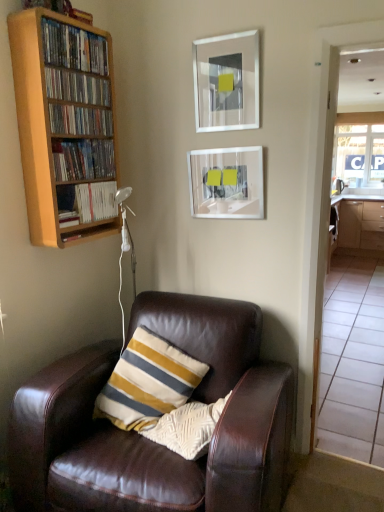
This screenshot has width=384, height=512. What do you see at coordinates (356, 165) in the screenshot?
I see `transparent glass door at right` at bounding box center [356, 165].

Looking at this image, what is the approximate height of brown leather chair at lower left?

34.05 inches.

What do you see at coordinates (77, 87) in the screenshot? I see `wooden shelf at upper left, which is the 2th book from top to bottom` at bounding box center [77, 87].

Find the location of `wooden bookshelf at upper left, the 2th book when ordered from bottom to top`. wooden bookshelf at upper left, the 2th book when ordered from bottom to top is located at coordinates (83, 159).

In order to face white glossy cabinetry at right, should I rotate leftwards or rightwards?

To align with it, rotate right about 21.681°.

In order to face wooden bookshelf at upper left, acting as the 3th book starting from the bottom, should I rotate leftwards or rightwards?

To face it directly, rotate left by 15.119 degrees.

Identify the location of transparent glass door at right. The image size is (384, 512). (356, 165).

Is white glossy cabinetry at right further to the viewer compared to silver metallic picture frame at upper center, the second picture frame ordered from the bottom?

Yes, white glossy cabinetry at right is further from the viewer.

Based on the photo, can you tell me how much white glossy cabinetry at right and silver metallic picture frame at upper center, the 1th picture frame when ordered from top to bottom, differ in facing direction?

They differ by 0.432 degrees in their facing directions.

From a real-world perspective, is white glossy cabinetry at right physically below silver metallic picture frame at upper center, the second picture frame ordered from the bottom?

Yes, from a real-world perspective, white glossy cabinetry at right is under silver metallic picture frame at upper center, the second picture frame ordered from the bottom.

Can you confirm if white glossy cabinetry at right is bigger than silver metallic picture frame at upper center, the second picture frame ordered from the bottom?

Yes.

Which object is more forward, wooden shelf at upper left, which is the 2th book from top to bottom, or wooden bookshelf at upper left, acting as the 3th book starting from the bottom?

wooden shelf at upper left, which is the 2th book from top to bottom, is closer to the camera.

From a real-world perspective, is wooden shelf at upper left, positioned as the fourth book in bottom-to-top order, above or below wooden bookshelf at upper left, the 3th book positioned from the top?

From a real-world perspective, wooden shelf at upper left, positioned as the fourth book in bottom-to-top order, is physically above wooden bookshelf at upper left, the 3th book positioned from the top.

Is wooden shelf at upper left, positioned as the fourth book in bottom-to-top order, facing towards wooden bookshelf at upper left, acting as the 3th book starting from the bottom?

No, wooden shelf at upper left, positioned as the fourth book in bottom-to-top order, is not turned towards wooden bookshelf at upper left, acting as the 3th book starting from the bottom.

Considering the sizes of objects wooden shelf at upper left, which is the 2th book from top to bottom, and wooden bookshelf at upper left, the 3th book positioned from the top, in the image provided, who is smaller, wooden shelf at upper left, which is the 2th book from top to bottom, or wooden bookshelf at upper left, the 3th book positioned from the top,?

wooden bookshelf at upper left, the 3th book positioned from the top, is smaller.

Does wooden bookcase at left have a larger size compared to wooden shelf at upper left, which is the 2th book from top to bottom?

Yes, wooden bookcase at left is bigger than wooden shelf at upper left, which is the 2th book from top to bottom.

Considering the sizes of wooden bookcase at left and wooden shelf at upper left, positioned as the fourth book in bottom-to-top order, in the image, is wooden bookcase at left wider or thinner than wooden shelf at upper left, positioned as the fourth book in bottom-to-top order,?

Considering their sizes, wooden bookcase at left looks broader than wooden shelf at upper left, positioned as the fourth book in bottom-to-top order.

Does wooden bookcase at left appear on the left side of wooden shelf at upper left, which is the 2th book from top to bottom?

Yes, wooden bookcase at left is to the left of wooden shelf at upper left, which is the 2th book from top to bottom.

Considering the points (47, 23) and (96, 94), which point is in front, point (47, 23) or point (96, 94)?

The point (47, 23) is closer to the camera.

How distant is wooden shelf at upper left, arranged as the first book when viewed from the top, from wooden bookcase at left?

wooden shelf at upper left, arranged as the first book when viewed from the top, and wooden bookcase at left are 8.12 inches apart.

Considering the relative sizes of wooden shelf at upper left, arranged as the first book when viewed from the top, and wooden bookcase at left in the image provided, is wooden shelf at upper left, arranged as the first book when viewed from the top, bigger than wooden bookcase at left?

No.

Would you say wooden shelf at upper left, placed as the 5th book when sorted from bottom to top, is inside or outside wooden bookcase at left?

wooden shelf at upper left, placed as the 5th book when sorted from bottom to top, can be found inside wooden bookcase at left.

Relative to wooden bookcase at left, is wooden shelf at upper left, placed as the 5th book when sorted from bottom to top, in front or behind?

Visually, wooden shelf at upper left, placed as the 5th book when sorted from bottom to top, is located behind wooden bookcase at left.

At what (x,y) coordinates should I click in order to perform the action: click on cabinetry that is behind the silver metallic picture frame at upper center, the 1th picture frame when ordered from top to bottom. Please return your answer as a coordinate pair (x, y). This screenshot has width=384, height=512. Looking at the image, I should click on (361, 225).

Is point (231, 66) farther from viewer compared to point (364, 246)?

No, it is in front of (364, 246).

Is silver metallic picture frame at upper center, the 1th picture frame when ordered from top to bottom, facing away from white glossy cabinetry at right?

Yes, silver metallic picture frame at upper center, the 1th picture frame when ordered from top to bottom, is positioned with its back facing white glossy cabinetry at right.

From the image's perspective, who appears lower, silver metallic picture frame at upper center, the 1th picture frame when ordered from top to bottom, or white glossy cabinetry at right?

white glossy cabinetry at right, from the image's perspective.

Is transparent glass window at right inside wooden bookcase at left?

No, transparent glass window at right is not a part of wooden bookcase at left.

Which of these two, wooden bookcase at left or transparent glass window at right, is thinner?

With smaller width is transparent glass window at right.

Who is taller, wooden bookcase at left or transparent glass window at right?

Standing taller between the two is transparent glass window at right.

Considering the sizes of objects wooden bookcase at left and transparent glass window at right in the image provided, who is smaller, wooden bookcase at left or transparent glass window at right?

transparent glass window at right.

Does brown leather chair at lower left have a greater width compared to transparent glass window at right?

Yes.

Does brown leather chair at lower left come in front of transparent glass window at right?

That is True.

Could you tell me if brown leather chair at lower left is turned towards transparent glass window at right?

No, brown leather chair at lower left is not aimed at transparent glass window at right.

Does brown leather chair at lower left appear on the right side of transparent glass window at right?

In fact, brown leather chair at lower left is to the left of transparent glass window at right.

Locate an element on the screen. This screenshot has width=384, height=512. picture frame located above the white glossy cabinetry at right (from the image's perspective) is located at coordinates (226, 82).

From a real-world perspective, count 1st books upward from the wooden bookshelf at upper left, acting as the 3th book starting from the bottom, and point to it. Please provide its 2D coordinates.

[(77, 87)]

Which object lies further to the anchor point transparent glass window at right, brown leather chair at lower left or transparent glass door at right?

Based on the image, brown leather chair at lower left appears to be further to transparent glass window at right.

Based on the photo, based on their spatial positions, is wooden shelf at upper left, arranged as the first book when viewed from the top, or transparent glass window at right closer to white glossy cabinetry at right?

transparent glass window at right is positioned closer to the anchor white glossy cabinetry at right.

When comparing their distances from wooden shelf at upper left, arranged as the first book when viewed from the top, does transparent glass window at right or wooden bookshelf at upper left, acting as the 3th book starting from the bottom, seem further?

transparent glass window at right.

Which object lies further to the anchor point matte glass picture frame at upper center, the second picture frame positioned from the top, transparent glass window at right or wooden shelf at upper left, placed as the 5th book when sorted from bottom to top?

transparent glass window at right lies further to matte glass picture frame at upper center, the second picture frame positioned from the top, than the other object.

Considering their positions, is white glossy cabinetry at right positioned closer to matte glass picture frame at upper center, the 1th picture frame ordered from the bottom, than wooden bookshelf at upper left, the 3th book positioned from the top?

Among the two, wooden bookshelf at upper left, the 3th book positioned from the top, is located nearer to matte glass picture frame at upper center, the 1th picture frame ordered from the bottom.

Based on their spatial positions, is silver metallic picture frame at upper center, the 1th picture frame when ordered from top to bottom, or transparent glass window at right closer to transparent glass door at right?

transparent glass window at right is positioned closer to the anchor transparent glass door at right.

When comparing their distances from silver metallic picture frame at upper center, the 1th picture frame when ordered from top to bottom, does wooden shelf at upper left, which is the 2th book from top to bottom, or wooden bookshelf at upper left, the 3th book positioned from the top, seem closer?

Among the two, wooden shelf at upper left, which is the 2th book from top to bottom, is located nearer to silver metallic picture frame at upper center, the 1th picture frame when ordered from top to bottom.

Looking at the image, which one is located closer to wooden bookshelf at upper left, acting as the 5th book starting from the top, brown leather chair at lower left or wooden bookshelf at upper left, which is the 4th book in top-to-bottom order?

wooden bookshelf at upper left, which is the 4th book in top-to-bottom order, is closer to wooden bookshelf at upper left, acting as the 5th book starting from the top.

You are a GUI agent. You are given a task and a screenshot of the screen. Output one action in this format:
    pyautogui.click(x=<x>, y=<y>)
    Task: Click on the chair between wooden bookcase at left and transparent glass door at right in the horizontal direction
    The width and height of the screenshot is (384, 512).
    Given the screenshot: What is the action you would take?
    pyautogui.click(x=148, y=440)

In order to click on bookcase between wooden shelf at upper left, arranged as the first book when viewed from the top, and matte glass picture frame at upper center, the second picture frame positioned from the top, from left to right in this screenshot , I will do `click(64, 125)`.

This screenshot has width=384, height=512. Find the location of `cabinetry between wooden shelf at upper left, positioned as the fourth book in bottom-to-top order, and transparent glass window at right from front to back`. cabinetry between wooden shelf at upper left, positioned as the fourth book in bottom-to-top order, and transparent glass window at right from front to back is located at coordinates (361, 225).

Where is `bookcase between wooden bookshelf at upper left, acting as the 3th book starting from the bottom, and brown leather chair at lower left in the up-down direction`? This screenshot has height=512, width=384. bookcase between wooden bookshelf at upper left, acting as the 3th book starting from the bottom, and brown leather chair at lower left in the up-down direction is located at coordinates (64, 125).